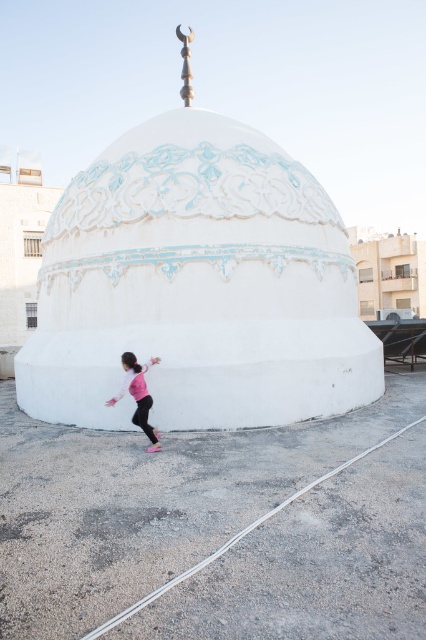
Question: Does white glossy dome at center have a greater width compared to pink fabric child at lower left?

Choices:
 (A) yes
 (B) no

Answer: (A)

Question: Which point is farther to the camera?

Choices:
 (A) white glossy dome at center
 (B) pink fabric child at lower left

Answer: (A)

Question: Does white glossy dome at center have a lesser width compared to pink fabric child at lower left?

Choices:
 (A) yes
 (B) no

Answer: (B)

Question: Which object is farther from the camera taking this photo?

Choices:
 (A) pink fabric child at lower left
 (B) white glossy dome at center

Answer: (B)

Question: Does white glossy dome at center appear on the right side of pink fabric child at lower left?

Choices:
 (A) yes
 (B) no

Answer: (B)

Question: Which object is farther from the camera taking this photo?

Choices:
 (A) pink fabric child at lower left
 (B) white glossy dome at center

Answer: (B)